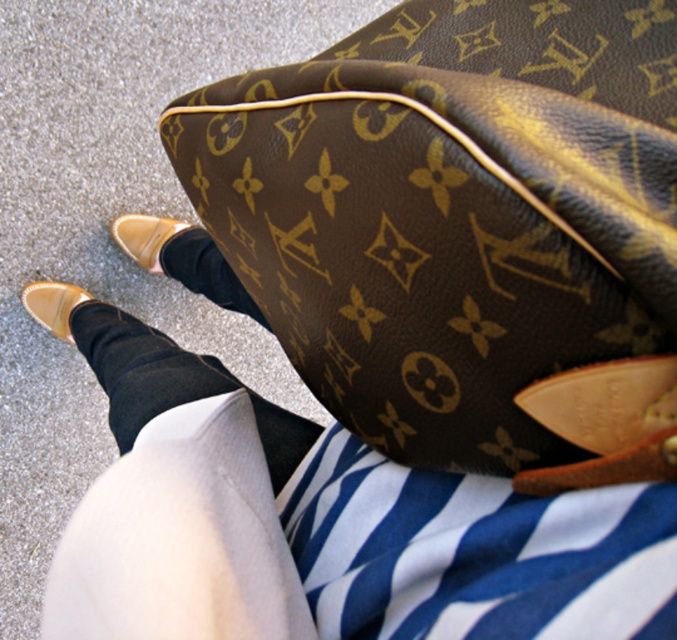
Who is more distant from viewer, (418, 580) or (232, 275)?

The point (232, 275) is more distant.

Is brown leather bag at upper center to the right of black smooth sock at lower center from the viewer's perspective?

Incorrect, brown leather bag at upper center is not on the right side of black smooth sock at lower center.

This screenshot has width=677, height=640. What do you see at coordinates (345, 522) in the screenshot? I see `brown leather bag at upper center` at bounding box center [345, 522].

You are a GUI agent. You are given a task and a screenshot of the screen. Output one action in this format:
    pyautogui.click(x=<x>, y=<y>)
    Task: Click on the brown leather bag at upper center
    Image resolution: width=677 pixels, height=640 pixels.
    Given the screenshot: What is the action you would take?
    pyautogui.click(x=345, y=522)

Which is below, brown monogrammed leather handbag at center or brown leather bag at upper center?

brown leather bag at upper center is lower down.

Between brown monogrammed leather handbag at center and brown leather bag at upper center, which one has less height?

With less height is brown leather bag at upper center.

Between point (672, 212) and point (144, 570), which one is positioned in front?

Point (672, 212) is in front.

Where is `brown monogrammed leather handbag at center`? This screenshot has width=677, height=640. brown monogrammed leather handbag at center is located at coordinates (450, 212).

Is black glittery sock at lower center above matte tan leather shoe at lower left?

Incorrect, black glittery sock at lower center is not positioned above matte tan leather shoe at lower left.

Is point (114, 429) behind point (68, 292)?

No, it is in front of (68, 292).

Find the location of a particular element. Image resolution: width=677 pixels, height=640 pixels. black glittery sock at lower center is located at coordinates (173, 385).